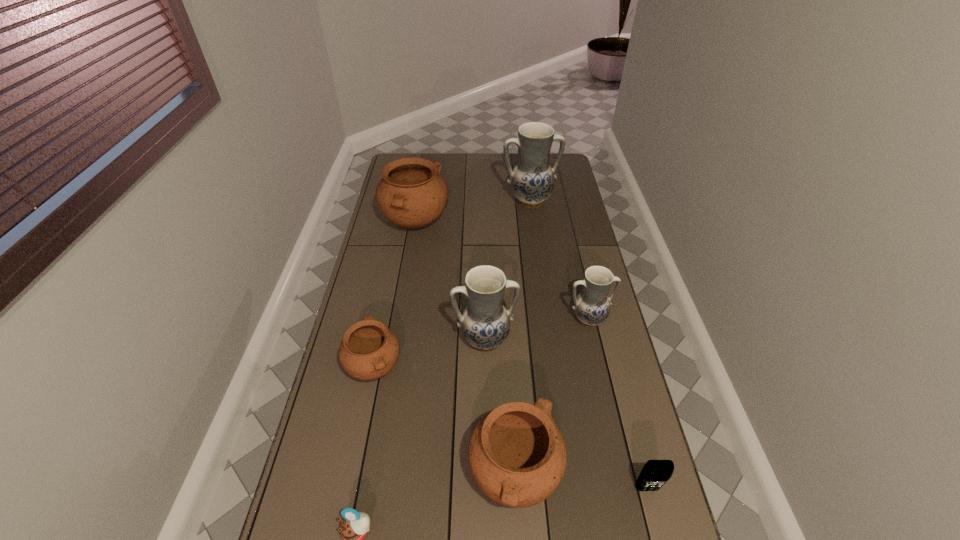
At what (x,y) coordinates should I click in order to perform the action: click on free space located on the left of the biggest blue pottery. Please return your answer as a coordinate pair (x, y). Image resolution: width=960 pixels, height=540 pixels. Looking at the image, I should click on (415, 200).

I want to click on free spot located 0.080m on the front of the second smallest blue pottery, so click(x=485, y=381).

Identify the location of vacant space located on the right of the farthest terracotta pottery. This screenshot has width=960, height=540. (475, 223).

Identify the location of vacant region located on the front of the smallest blue pottery. The height and width of the screenshot is (540, 960). (611, 414).

The height and width of the screenshot is (540, 960). I want to click on vacant space located 0.140m on the back of the rightmost terracotta pottery, so click(510, 386).

What are the coordinates of `vacant region located 0.120m on the right of the second farthest terracotta pottery` in the screenshot? It's located at (441, 366).

Find the location of a particular element. The height and width of the screenshot is (540, 960). free space located on the screen of the cellular telephone is located at coordinates (657, 530).

Identify the location of cellular telephone at the right edge. (655, 473).

Where is `free space at the left edge`? This screenshot has width=960, height=540. free space at the left edge is located at coordinates (396, 266).

Image resolution: width=960 pixels, height=540 pixels. I want to click on free spot at the right edge of the desktop, so click(578, 361).